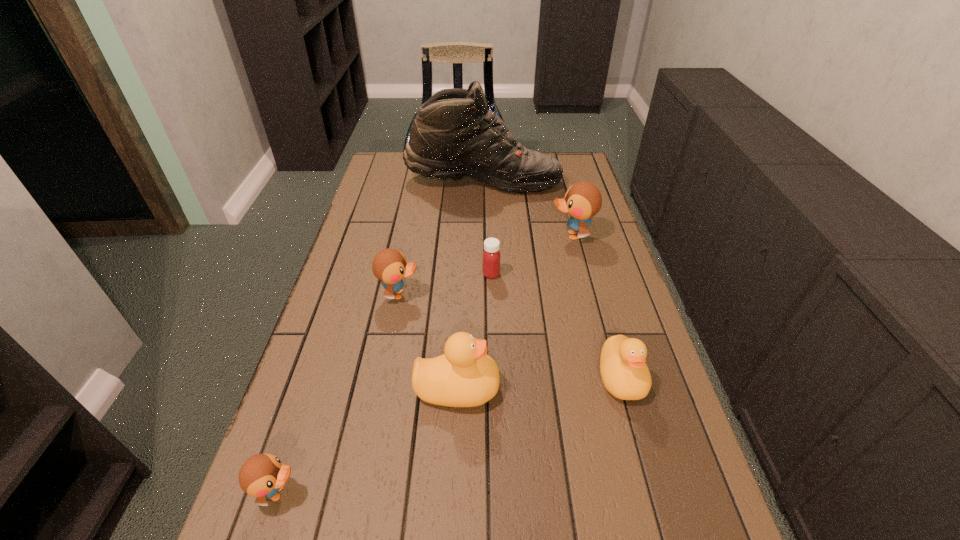
The image size is (960, 540). Find the location of `red medicine`. red medicine is located at coordinates (491, 256).

This screenshot has height=540, width=960. Identify the location of the nearest blue duck. (262, 475).

You are a GUI agent. You are given a task and a screenshot of the screen. Output one action in this format:
    pyautogui.click(x=<x>, y=<y>)
    Task: Click on the nearest object
    This screenshot has height=540, width=960.
    Given the screenshot: What is the action you would take?
    pyautogui.click(x=262, y=475)

Locate an element on the screen. This screenshot has height=540, width=960. vacant area located on the back of the farthest object is located at coordinates (483, 160).

Locate an element on the screen. vacant space positioned on the front-facing side of the rightmost blue duck is located at coordinates (436, 235).

Find the location of a particular element. The width and height of the screenshot is (960, 540). free region located on the front-facing side of the rightmost blue duck is located at coordinates (492, 235).

Where is `vacant area located on the front-facing side of the rightmost blue duck`? This screenshot has height=540, width=960. vacant area located on the front-facing side of the rightmost blue duck is located at coordinates (482, 235).

The image size is (960, 540). What are the coordinates of `free region located 0.060m on the face of the third duck from left to right` in the screenshot? It's located at (527, 388).

Identify the location of free space located on the front-facing side of the fourth farthest object. This screenshot has width=960, height=540. (545, 294).

Image resolution: width=960 pixels, height=540 pixels. I want to click on free space located on the face of the smaller yellow duck, so click(x=638, y=438).